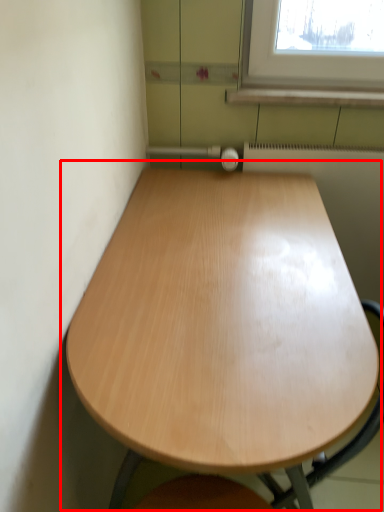
Question: From the image's perspective, where is table (annotated by the red box) located relative to radiator?

Choices:
 (A) above
 (B) below

Answer: (B)